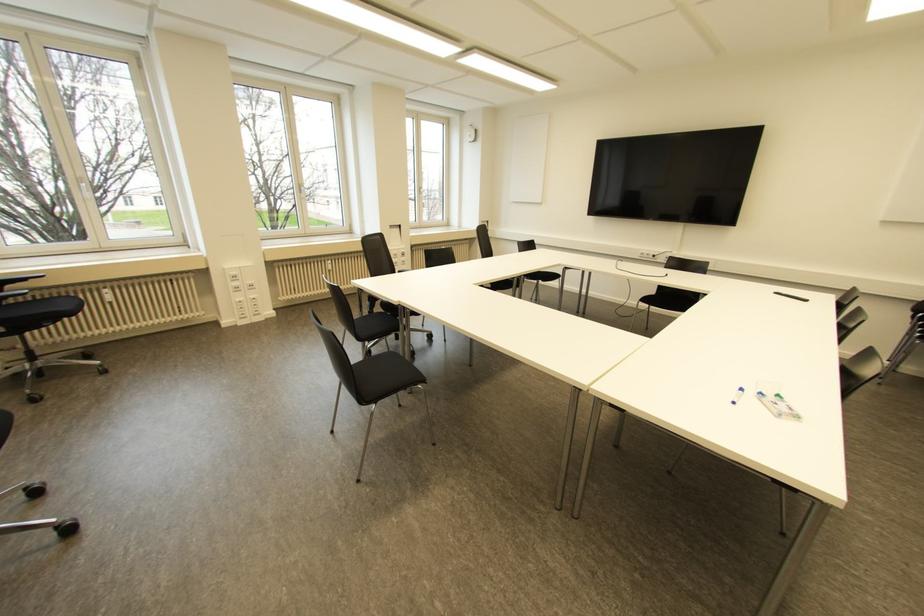
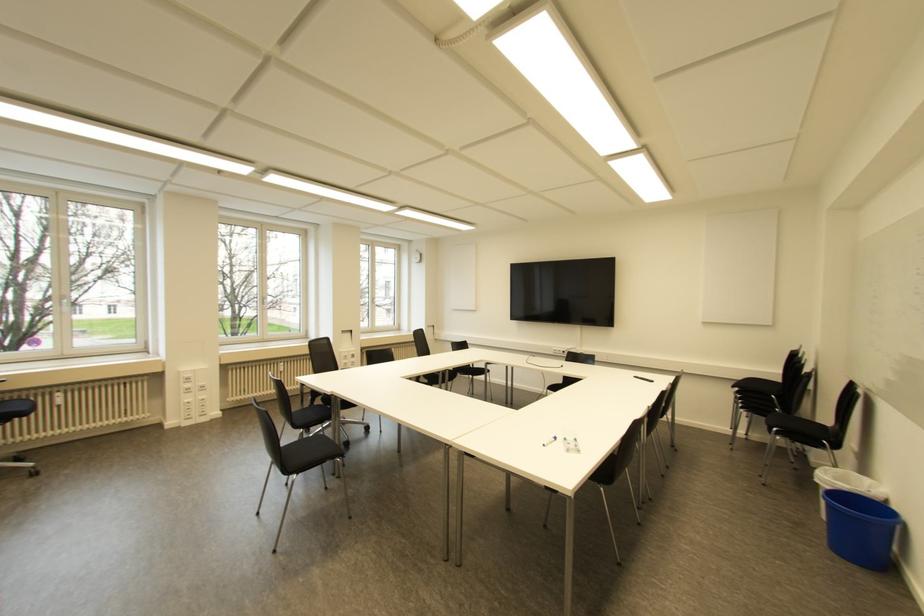
Find the pixel in the second image that matches point 422,381 in the first image.

(342, 455)